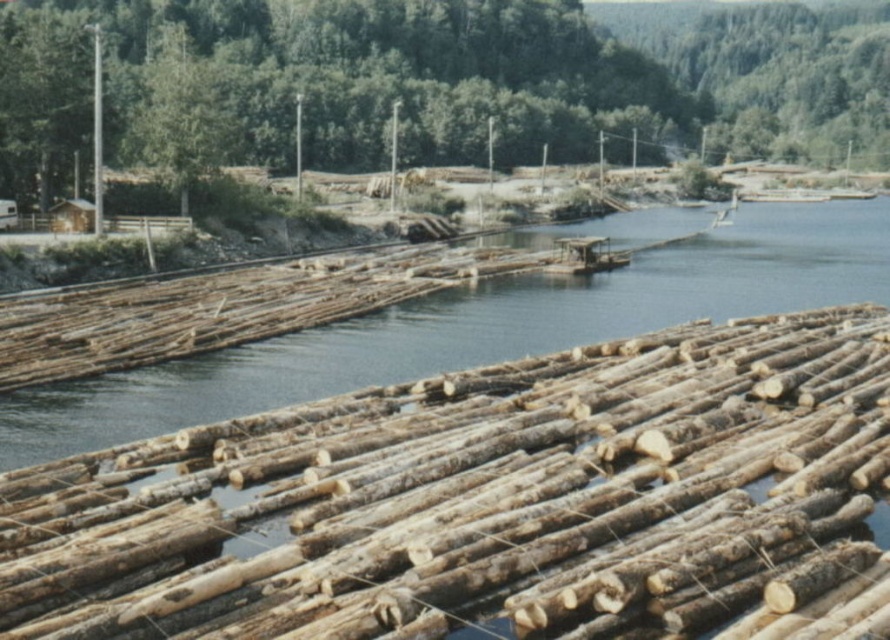
You are a forester looking at the logging operation scene. You notice the natural wood logs at center and the green leafy tree at upper center. Which object is positioned to the left of the other?

The natural wood logs at center are to the left of the green leafy tree at upper center.

You are a forester planning to transport the natural wood logs at center across the natural wood river at center. Considering the river width, will the logs fit comfortably without getting stuck?

The natural wood logs at center are narrower than the natural wood river at center, so they should fit comfortably and not get stuck during transportation.

You are a safety inspector checking the logging operation. You need to ensure that the natural wood logs at center are not blocking the natural wood river at center. Based on their positions, is there a risk of the logs obstructing the river flow?

The natural wood logs at center is located below natural wood river at center, so the logs are positioned downstream and may obstruct the river flow, posing a potential risk.